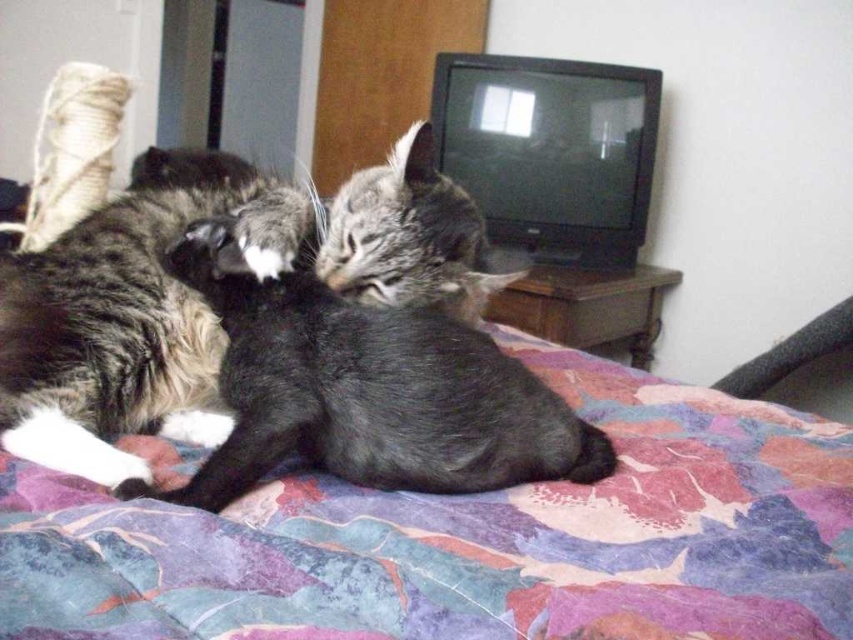
Question: Which point is closer to the camera?

Choices:
 (A) (816, 477)
 (B) (297, 369)
 (C) (10, 372)

Answer: (B)

Question: Which object is closer to the camera taking this photo?

Choices:
 (A) soft gray fur cat at center
 (B) floral fabric bedcover at center

Answer: (B)

Question: Can you confirm if soft gray fur cat at center is positioned above tabby fur cat at center?

Choices:
 (A) no
 (B) yes

Answer: (A)

Question: Where is floral fabric bedcover at center located in relation to soft gray fur cat at center in the image?

Choices:
 (A) right
 (B) left

Answer: (A)

Question: Which point is closer to the camera?

Choices:
 (A) (659, 483)
 (B) (445, 490)

Answer: (B)

Question: Does floral fabric bedcover at center have a larger size compared to soft gray fur cat at center?

Choices:
 (A) yes
 (B) no

Answer: (A)